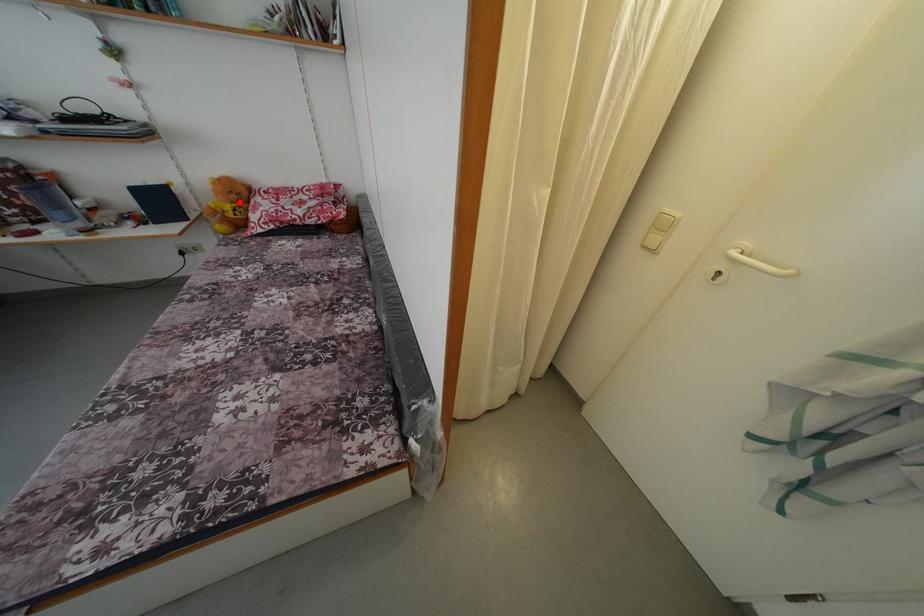
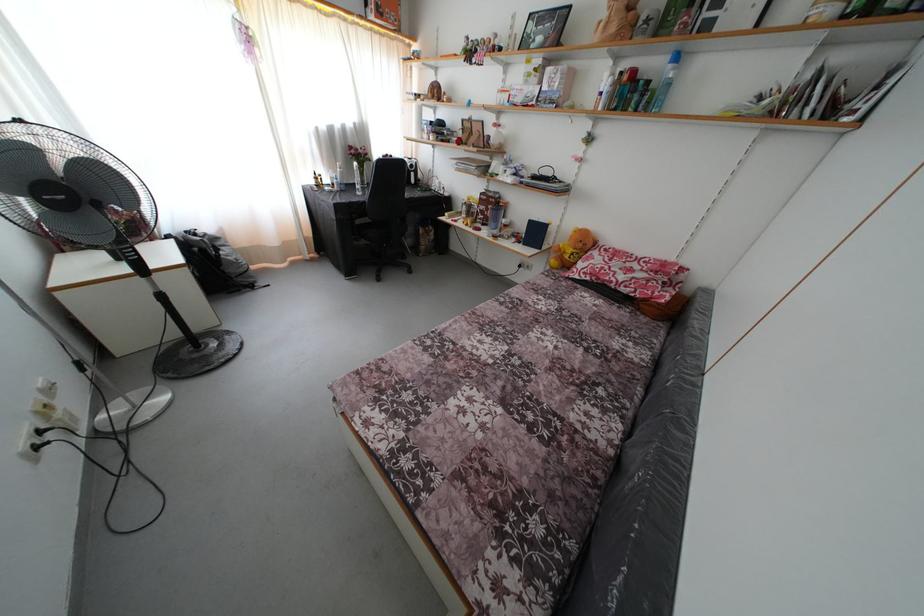
Question: I am providing you with two images of the same scene from different viewpoints. In image1, a red point is highlighted. Considering the same 3D point in image2, which of the following is correct?

Choices:
 (A) It is closer
 (B) It is farther

Answer: (A)